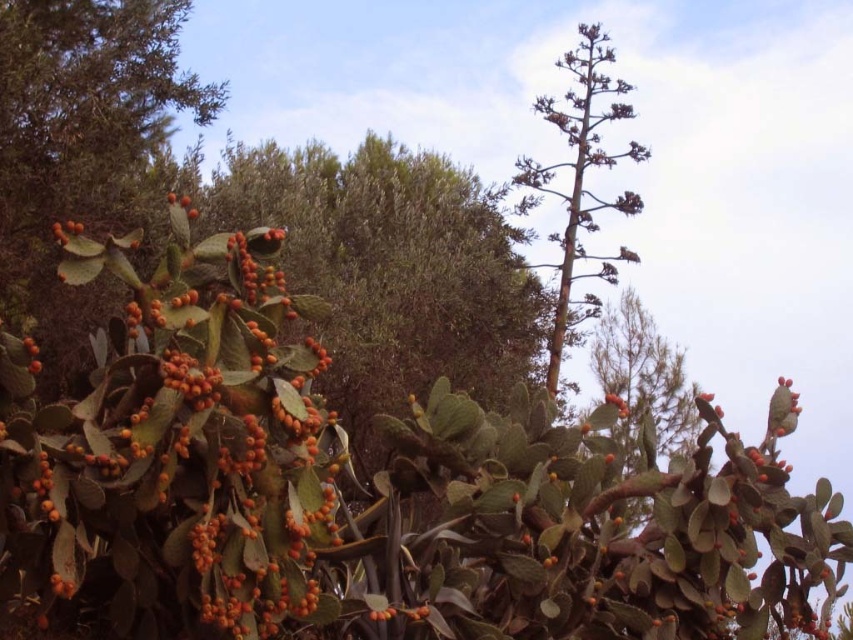
You are a botanist examining two orange matte fruits in the scene. The first is the orange matte cactus fruit at left, and the second is the orange matte fruit at lower left. Which of these two fruits is taller?

The orange matte cactus fruit at left is taller than the orange matte fruit at lower left.